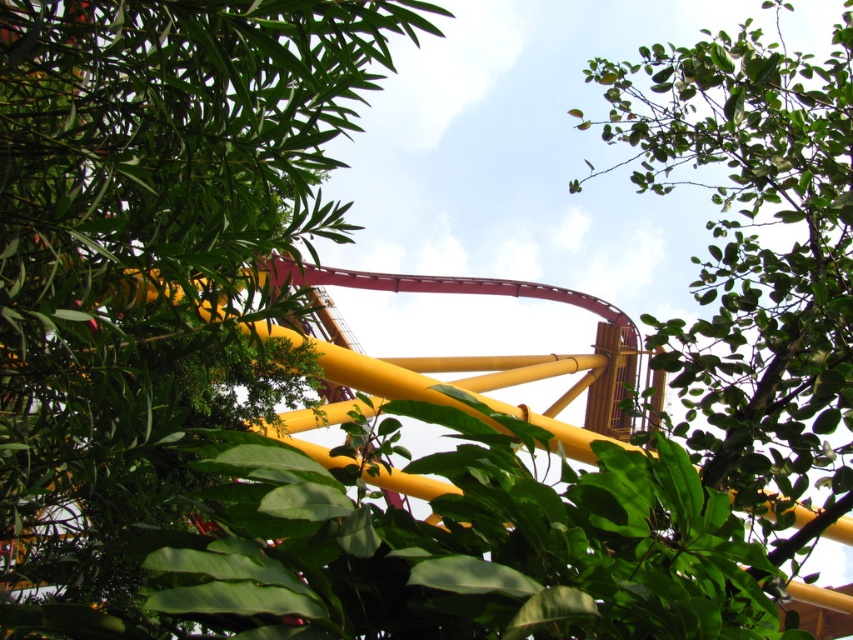
Does green leafy tree at upper left have a lesser width compared to green leafy tree at upper center?

No, green leafy tree at upper left is not thinner than green leafy tree at upper center.

Looking at this image, who is more forward, (x=26, y=524) or (x=746, y=493)?

Positioned in front is point (x=746, y=493).

The width and height of the screenshot is (853, 640). Identify the location of green leafy tree at upper left. (149, 260).